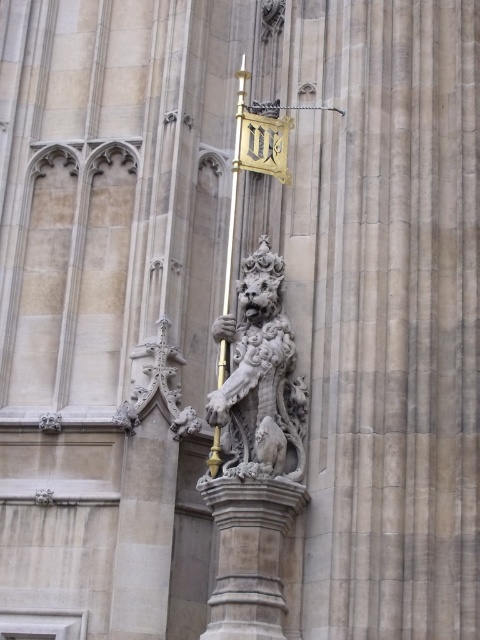
Question: Does white stone lion at center have a larger size compared to carved stone lion at center?

Choices:
 (A) yes
 (B) no

Answer: (A)

Question: In this image, where is carved stone lion at center located relative to gold polished metal pole at center?

Choices:
 (A) above
 (B) below

Answer: (B)

Question: Can you confirm if white stone lion at center is wider than gold polished metal pole at center?

Choices:
 (A) yes
 (B) no

Answer: (A)

Question: Which is nearer to the gold polished metal pole at center?

Choices:
 (A) white stone lion at center
 (B) carved stone lion at center
 (C) gold metallic flag at upper center

Answer: (A)

Question: Which object is the closest to the gold metallic flag at upper center?

Choices:
 (A) carved stone lion at center
 (B) gold polished metal pole at center
 (C) white stone lion at center

Answer: (C)

Question: Considering the real-world distances, which object is farthest from the gold metallic flag at upper center?

Choices:
 (A) gold polished metal pole at center
 (B) white stone lion at center

Answer: (A)